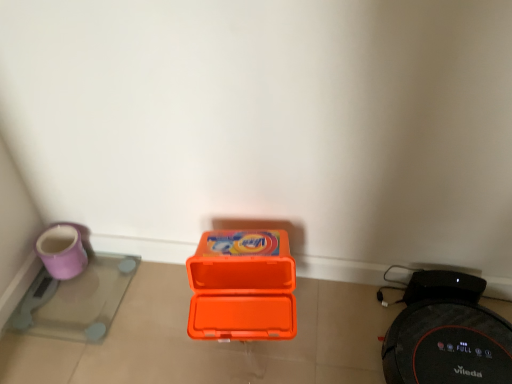
You are a GUI agent. You are given a task and a screenshot of the screen. Output one action in this format:
    pyautogui.click(x=<x>, y=<y>)
    Task: Click on the vacant space underneath purple glossy scale at lower left, the second appliance when ordered from right to left (from a real-world perspective)
    The height and width of the screenshot is (384, 512).
    Given the screenshot: What is the action you would take?
    pyautogui.click(x=75, y=298)